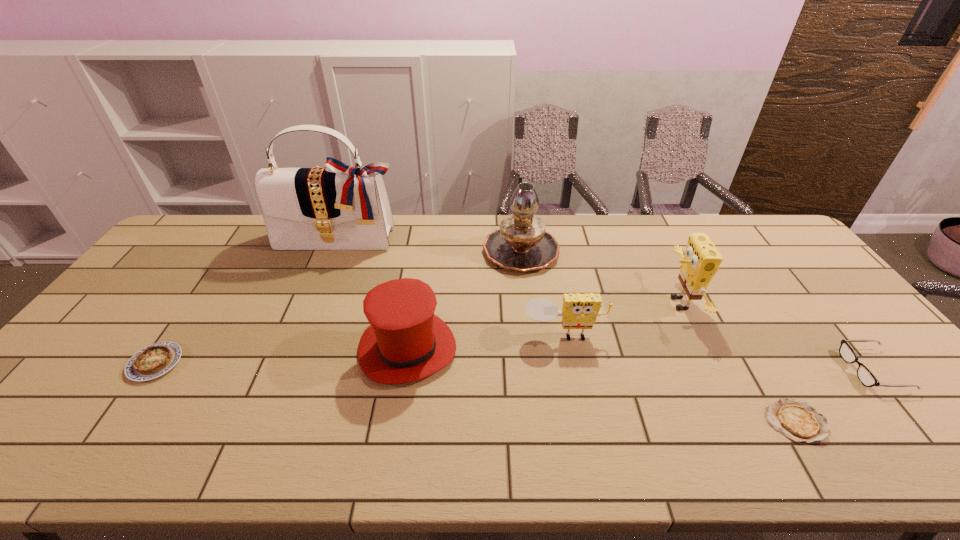
Identify the location of satchel. (333, 207).

Identify the location of oil lamp. This screenshot has height=540, width=960. (521, 243).

Locate an element on the screen. This screenshot has width=960, height=540. the sixth object from left to right is located at coordinates (701, 261).

The width and height of the screenshot is (960, 540). What are the coordinates of `the right sponge` in the screenshot? It's located at (701, 261).

I want to click on hat, so click(406, 342).

Locate an element on the screen. This screenshot has height=540, width=960. the left sponge is located at coordinates pyautogui.click(x=579, y=311).

What are the coordinates of `the shorter sponge` in the screenshot? It's located at (579, 311).

At what (x,y) coordinates should I click in order to perform the action: click on spectacles. Please return your answer as a coordinate pair (x, y). Looking at the image, I should click on (865, 376).

Locate an element on the screen. The image size is (960, 540). the rightmost object is located at coordinates (865, 376).

This screenshot has height=540, width=960. Find the location of `the second shortest object`. the second shortest object is located at coordinates (156, 359).